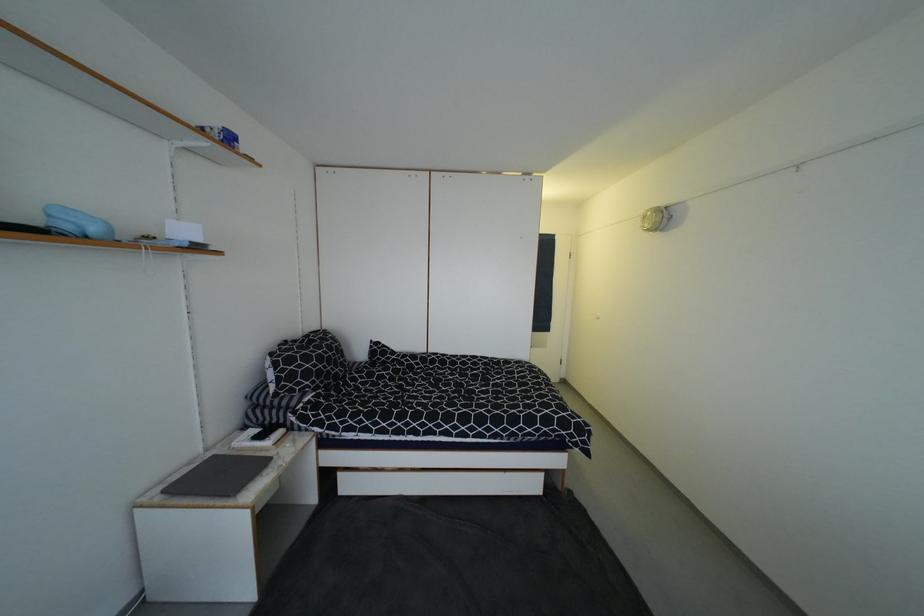
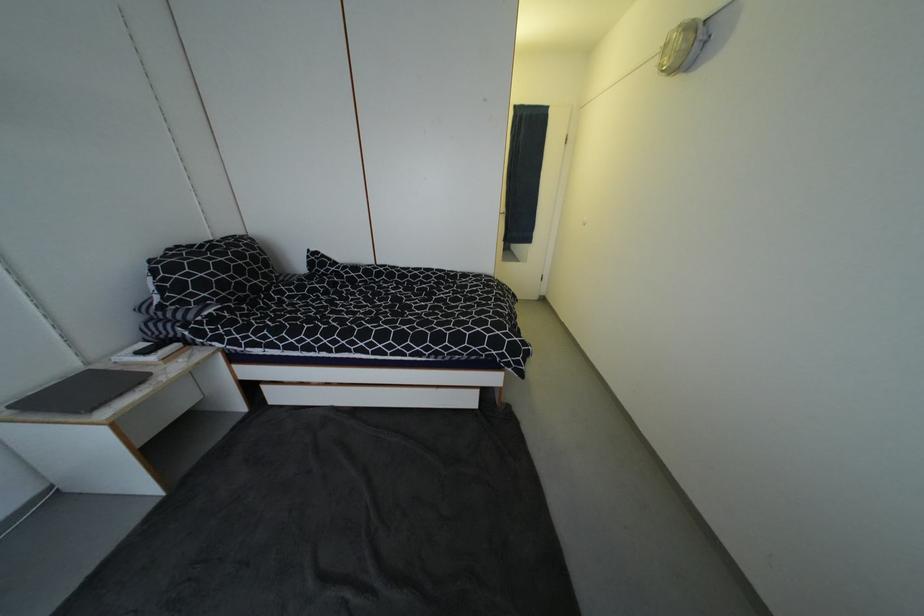
Which direction would the cameraman need to move to produce the second image?

The movement direction of the cameraman is right, forward.